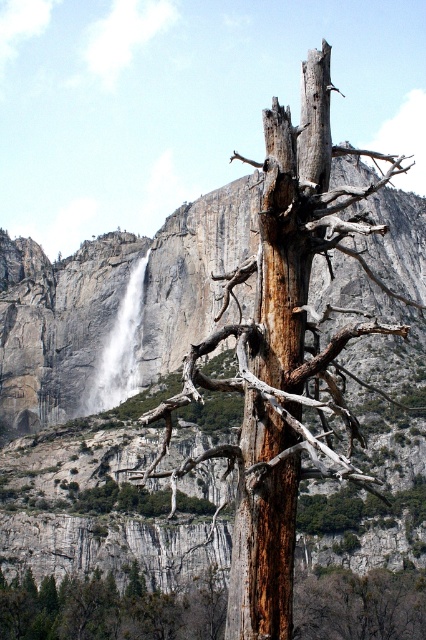
You are standing in the natural scene described. You notice two points marked in the image. The first point is at coordinates point (314, 468) and the second point is at point (325, 580). Which point is closer to you?

Point (314, 468) is in front of point (325, 580), so it is closer to you.

You are standing at the center of the image and want to take a photo of the brown wood tree at center. Which direction should you move to get a better view of the tree without the waterfall in the background?

Since the brown wood tree at center is located at point (284,355), you should move towards the tree to ensure it is the main focus and avoid the waterfall in the background.

You are a hiker standing at the base of the brown wood tree at center and want to reach the white textured waterfall at center. Which direction should you move to get closer to the waterfall?

The brown wood tree at center is located above the white textured waterfall at center, so you should move downward to get closer to the waterfall.